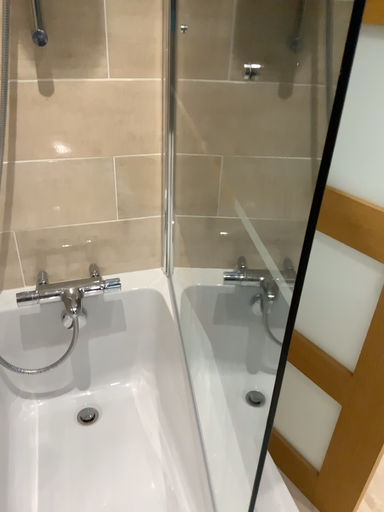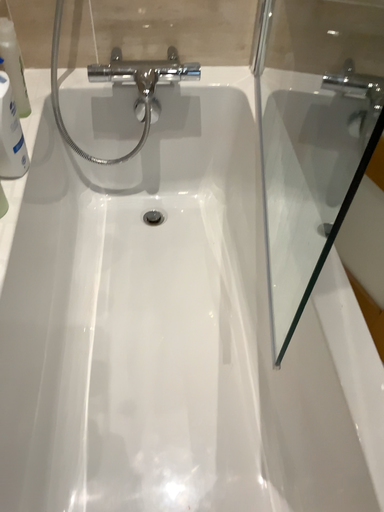
Question: Which way did the camera rotate in the video?

Choices:
 (A) rotated right
 (B) rotated left

Answer: (B)